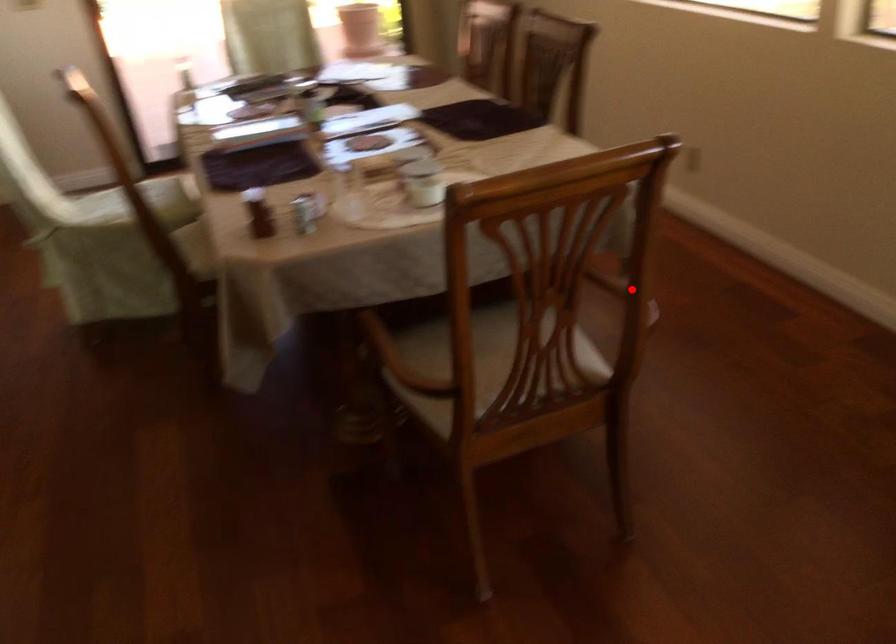
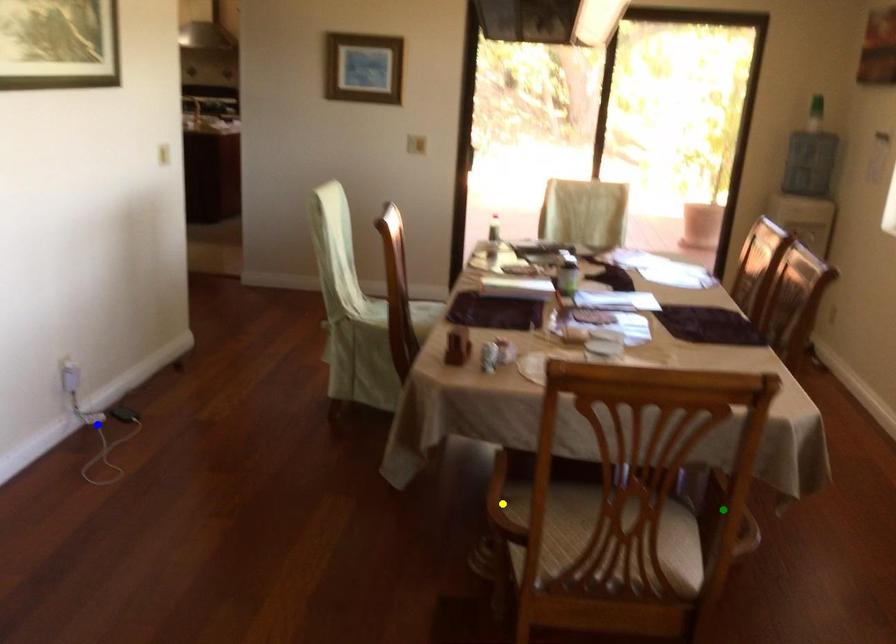
Question: I am providing you with two images of the same scene from different viewpoints. A red point is marked on the first image. You are given multiple points on the second image. Which point in image 2 is actually the same real-world point as the red point in image 1?

Choices:
 (A) blue point
 (B) yellow point
 (C) green point

Answer: (C)